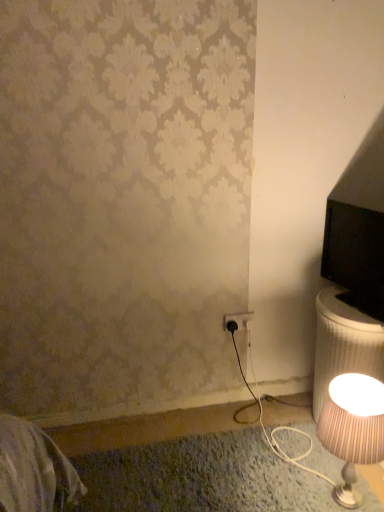
Question: Is striped fabric lampshade at lower right taller or shorter than black plastic outlet at lower center?

Choices:
 (A) short
 (B) tall

Answer: (B)

Question: Based on their positions, is striped fabric lampshade at lower right located to the left or right of black plastic outlet at lower center?

Choices:
 (A) right
 (B) left

Answer: (A)

Question: Considering the positions of point (352, 402) and point (244, 326), is point (352, 402) closer or farther from the camera than point (244, 326)?

Choices:
 (A) closer
 (B) farther

Answer: (A)

Question: From a real-world perspective, is black plastic outlet at lower center physically located above or below striped fabric lampshade at lower right?

Choices:
 (A) below
 (B) above

Answer: (B)

Question: In the image, is black plastic outlet at lower center positioned in front of or behind striped fabric lampshade at lower right?

Choices:
 (A) front
 (B) behind

Answer: (B)

Question: Considering the positions of black plastic outlet at lower center and striped fabric lampshade at lower right in the image, is black plastic outlet at lower center wider or thinner than striped fabric lampshade at lower right?

Choices:
 (A) wide
 (B) thin

Answer: (B)

Question: Is point (240, 329) closer or farther from the camera than point (321, 426)?

Choices:
 (A) closer
 (B) farther

Answer: (B)